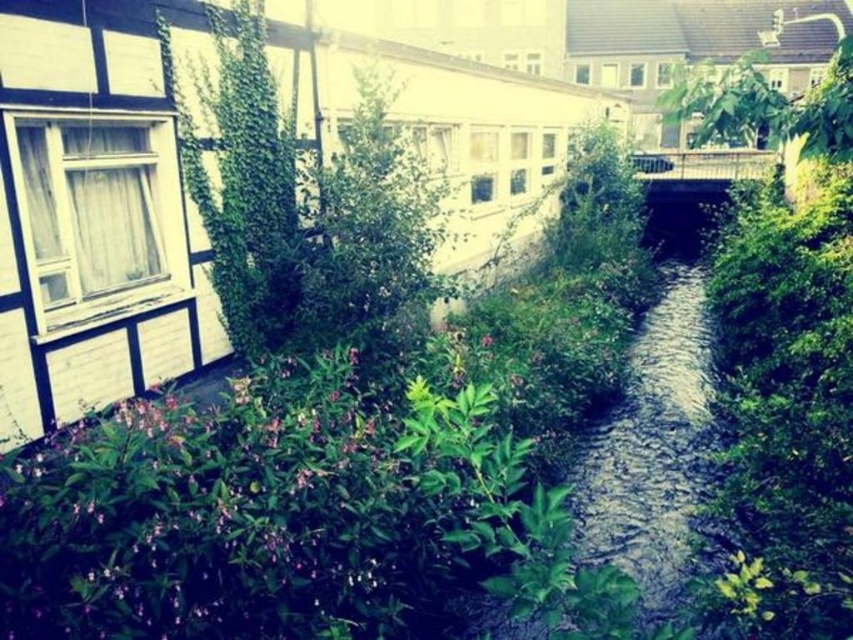
Question: Which object is closer to the camera taking this photo?

Choices:
 (A) clear water stream at center
 (B) green leafy plant at upper left

Answer: (A)

Question: Does green leafy bush at center-right have a lesser width compared to clear water stream at center?

Choices:
 (A) no
 (B) yes

Answer: (B)

Question: From the image, what is the correct spatial relationship of green leafy bush at center-right in relation to green leafy plant at upper left?

Choices:
 (A) left
 (B) right

Answer: (B)

Question: Among these objects, which one is nearest to the camera?

Choices:
 (A) green leafy bush at center-right
 (B) clear water stream at center

Answer: (B)

Question: Estimate the real-world distances between objects in this image. Which object is closer to the green leafy plant at upper left?

Choices:
 (A) green leafy bush at center-right
 (B) clear water stream at center

Answer: (B)

Question: Observing the image, what is the correct spatial positioning of green leafy bush at center-right in reference to clear water stream at center?

Choices:
 (A) left
 (B) right

Answer: (B)